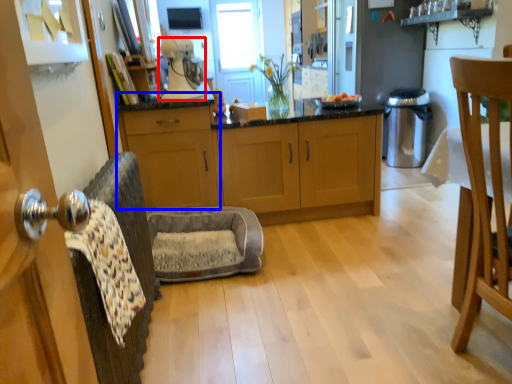
Question: Which point is closer to the camera, coffee machine (highlighted by a red box) or cabinetry (highlighted by a blue box)?

Choices:
 (A) coffee machine
 (B) cabinetry

Answer: (A)